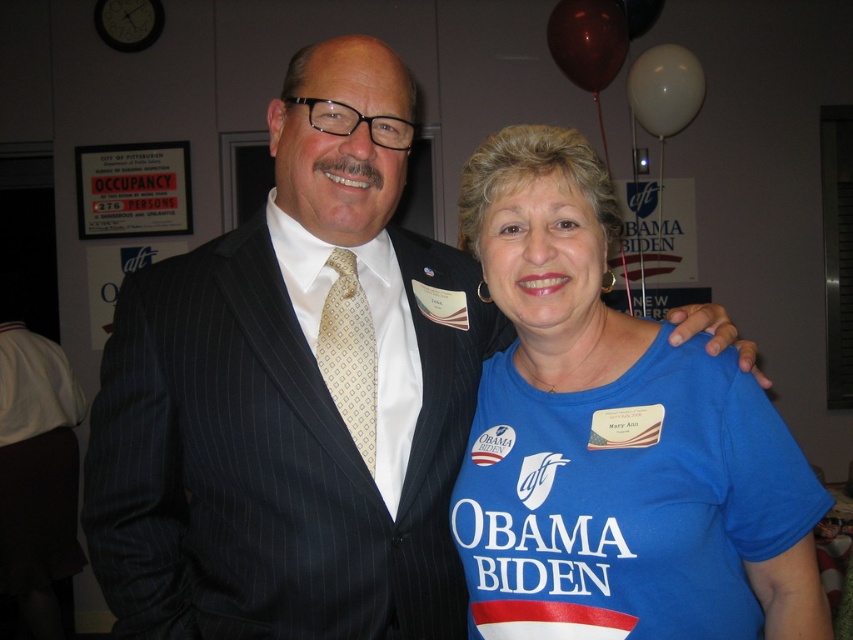
Question: From the image, what is the correct spatial relationship of shiny dark red balloon at upper center in relation to white matte balloon at upper right?

Choices:
 (A) below
 (B) above

Answer: (B)

Question: Can you confirm if blue fabric shirt at center is wider than matte gold tie at center?

Choices:
 (A) yes
 (B) no

Answer: (A)

Question: Which of the following is the farthest from the observer?

Choices:
 (A) (x=635, y=33)
 (B) (x=708, y=628)

Answer: (A)

Question: Is blue fabric shirt at center wider than matte gold tie at center?

Choices:
 (A) no
 (B) yes

Answer: (B)

Question: Among these points, which one is farthest from the camera?

Choices:
 (A) (659, 88)
 (B) (552, 22)

Answer: (B)

Question: Among these points, which one is farthest from the camera?

Choices:
 (A) (390, 304)
 (B) (566, 492)

Answer: (A)